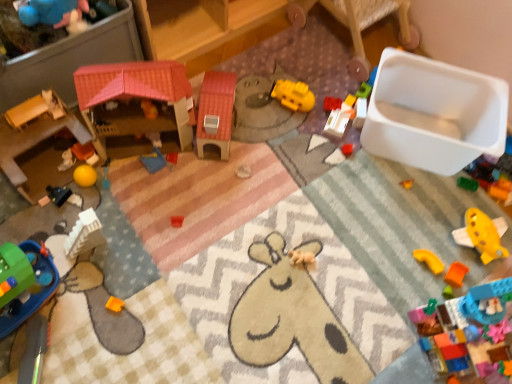
The width and height of the screenshot is (512, 384). I want to click on vacant area that lies between yellow matte plastic arch at lower right, acting as the 4th toy starting from the right, and bright red plastic blocks at center, which ranks as the ninth toy in left-to-right order, so click(384, 195).